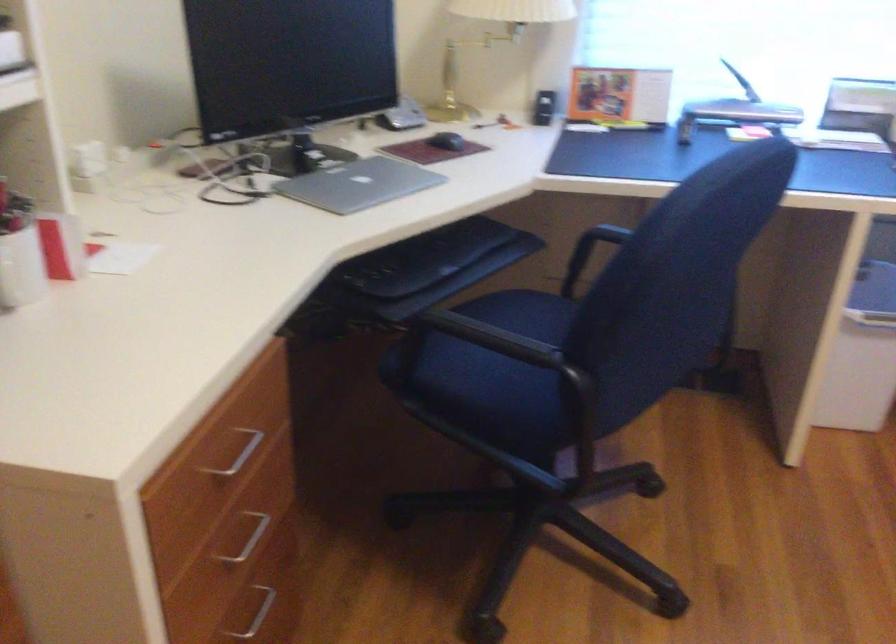
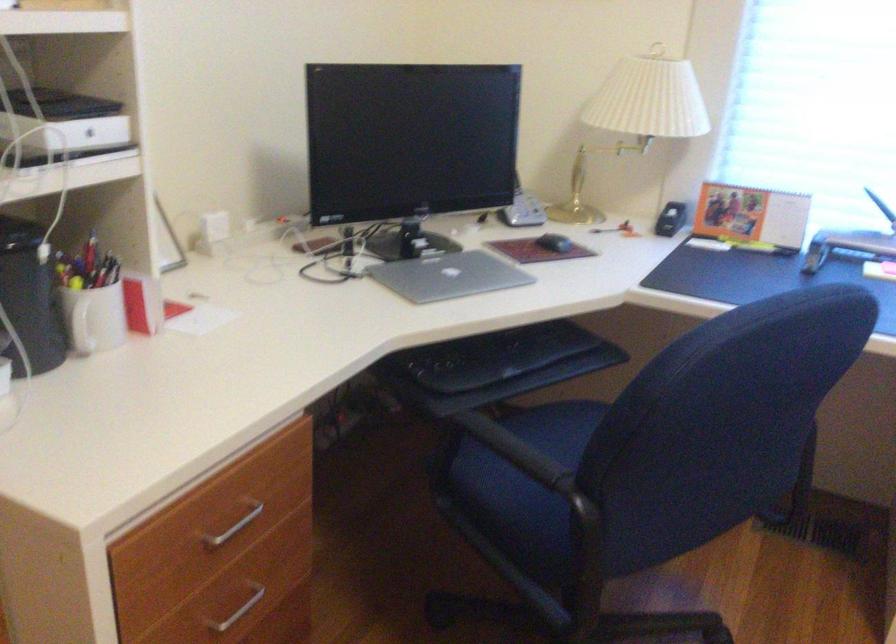
Find the pixel in the second image that matches (x=363, y=184) in the first image.

(449, 276)